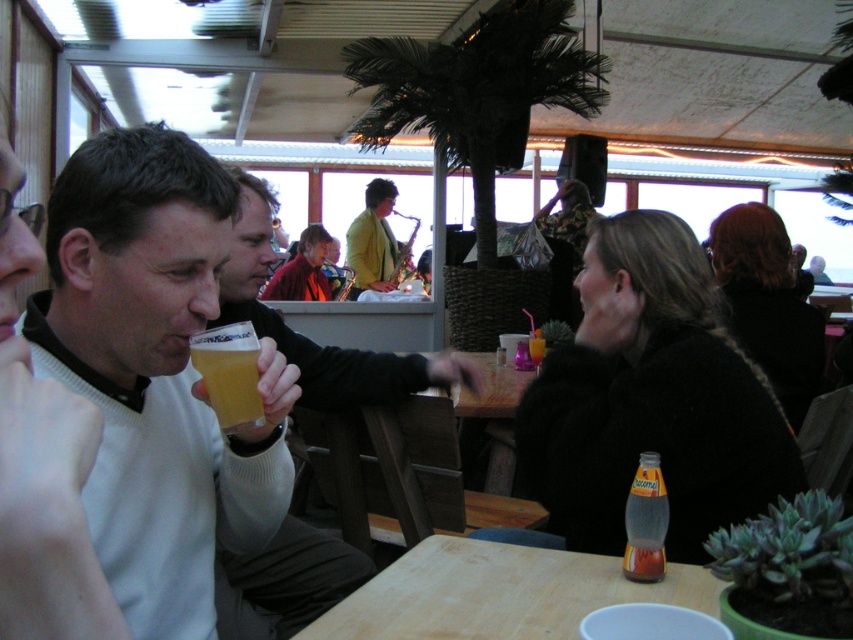
Is point (222, 588) closer to camera compared to point (628, 509)?

No, (222, 588) is further to viewer.

Locate an element on the screen. matte white sweater at center is located at coordinates (310, 339).

The height and width of the screenshot is (640, 853). Identify the location of matte white sweater at center. (310, 339).

Is matte white sweater at center taller than translucent plastic cup at table center?

Indeed, matte white sweater at center has a greater height compared to translucent plastic cup at table center.

The height and width of the screenshot is (640, 853). What do you see at coordinates (310, 339) in the screenshot?
I see `matte white sweater at center` at bounding box center [310, 339].

This screenshot has height=640, width=853. Find the location of `matte white sweater at center`. matte white sweater at center is located at coordinates (310, 339).

Which of these two, wooden table at center or matte yellow jacket at center, stands taller?

Standing taller between the two is matte yellow jacket at center.

Is wooden table at center taller than matte yellow jacket at center?

In fact, wooden table at center may be shorter than matte yellow jacket at center.

Is point (450, 611) closer to camera compared to point (363, 276)?

Yes, point (450, 611) is closer to viewer.

This screenshot has width=853, height=640. What are the coordinates of `wooden table at center` in the screenshot? It's located at (498, 593).